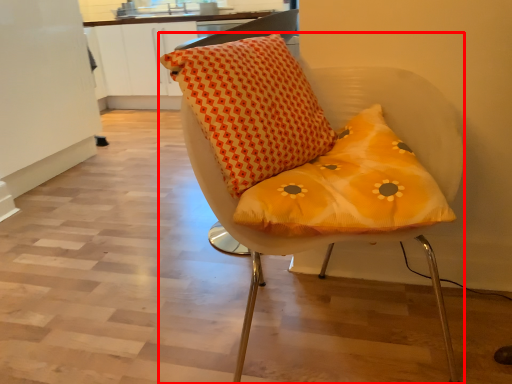
Question: From the image's perspective, where is chair (annotated by the red box) located relative to pillow?

Choices:
 (A) below
 (B) above

Answer: (A)